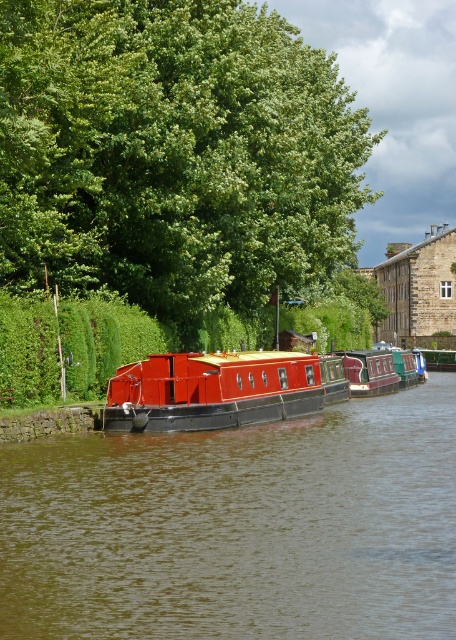
You are a photographer planning to take a photo of the green leafy tree at upper center and the smooth red boat at center. Considering their sizes, which object should you focus on to ensure both are clearly visible in the frame?

The green leafy tree at upper center is larger in size than the smooth red boat at center, so focusing on the tree will ensure both objects are clearly visible in the frame.

You are standing on the bank of the canal and looking at the green leafy tree at upper center and the metallic red barge at center. Which object appears wider from your perspective?

The green leafy tree at upper center appears wider than the metallic red barge at center because its width surpasses the barge.

You are standing at the edge of the canal and want to take a photo of the green leafy tree at upper center. If your camera has a maximum zoom range of 100 feet, will you be able to capture the tree clearly without moving closer?

The green leafy tree at upper center is 101.89 feet away from camera. Since the camera can only zoom up to 100 feet, you will not be able to capture the tree clearly without moving closer.